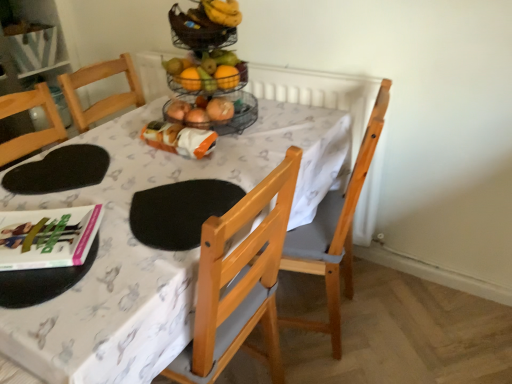
The height and width of the screenshot is (384, 512). I want to click on free space above hardcover book at lower left (from a real-world perspective), so click(38, 227).